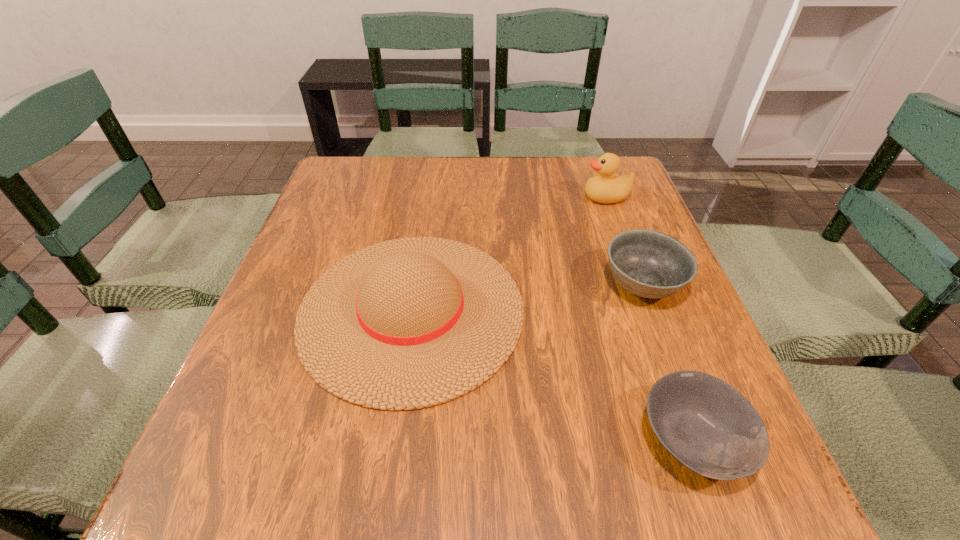
Identify the location of free region at the left edge of the desktop. The height and width of the screenshot is (540, 960). tap(375, 212).

In the image, there is a desktop. Where is `vacant area at the right edge`? The width and height of the screenshot is (960, 540). vacant area at the right edge is located at coordinates (675, 335).

In the image, there is a desktop. At what (x,y) coordinates should I click in order to perform the action: click on vacant space at the far left corner. Please return your answer as a coordinate pair (x, y). Looking at the image, I should click on (389, 163).

You are a GUI agent. You are given a task and a screenshot of the screen. Output one action in this format:
    pyautogui.click(x=<x>, y=<y>)
    Task: Click on the vacant space at the near left corner of the desktop
    Image resolution: width=960 pixels, height=540 pixels.
    Given the screenshot: What is the action you would take?
    pyautogui.click(x=270, y=482)

Where is `vacant position at the near right corner of the desktop`? This screenshot has width=960, height=540. vacant position at the near right corner of the desktop is located at coordinates (770, 493).

I want to click on free spot between the second shortest object and the bonnet, so click(527, 298).

Identify the location of free space between the bonnet and the shortest object. The height and width of the screenshot is (540, 960). (552, 375).

Locate an element on the screen. empty location between the nearer bowl and the farthest object is located at coordinates (650, 319).

Identify the location of free space between the farthest object and the bonnet. (509, 253).

I want to click on free spot between the third tallest object and the nearer bowl, so click(668, 362).